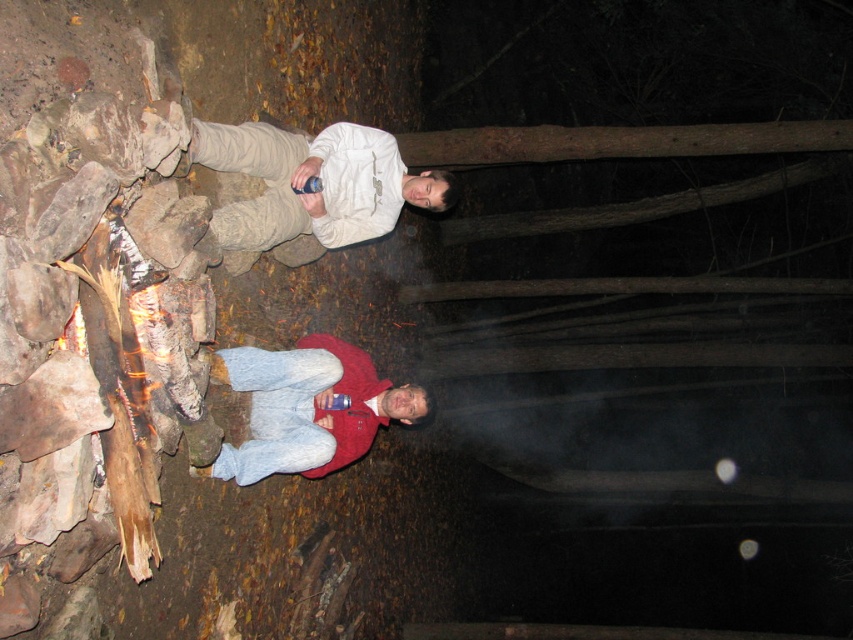
Between white matte shirt at upper center and red fleece jacket at center, which one has less height?

Standing shorter between the two is white matte shirt at upper center.

Which is behind, point (395, 211) or point (381, 385)?

Positioned behind is point (381, 385).

Which is in front, point (254, 141) or point (281, 448)?

Point (254, 141) is more forward.

Image resolution: width=853 pixels, height=640 pixels. In order to click on white matte shirt at upper center in this screenshot , I will do `click(312, 177)`.